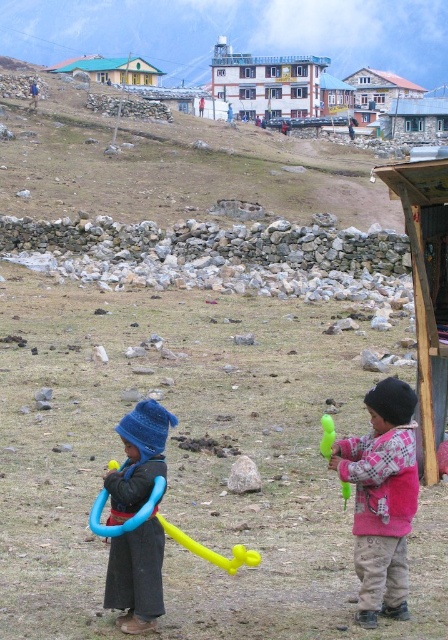
You are a parent trying to choose between two items for your child to play with. You see the white painted wood at upper center and the green rubber toy at right. Which item is wider?

The white painted wood at upper center is wider than the green rubber toy at right.

You are standing in the rural scene where two children are playing with bubble wands. You notice two points marked in the image. The first point is at coordinates point [396,122] and the second is at point [321,451]. Which point is closer to your current position?

Point [396,122] is further to the viewer than point [321,451], so the point closer to your position is point [321,451].

You are a drone operator trying to capture a photo of the gray stone hut at upper center and the green rubber toy at right. Can you position the drone so that both objects are visible without one blocking the other?

The gray stone hut at upper center is positioned over the green rubber toy at right, so if you position the drone above the gray stone hut at upper center, you might not be able to see the green rubber toy at right as it is blocked by the hut.